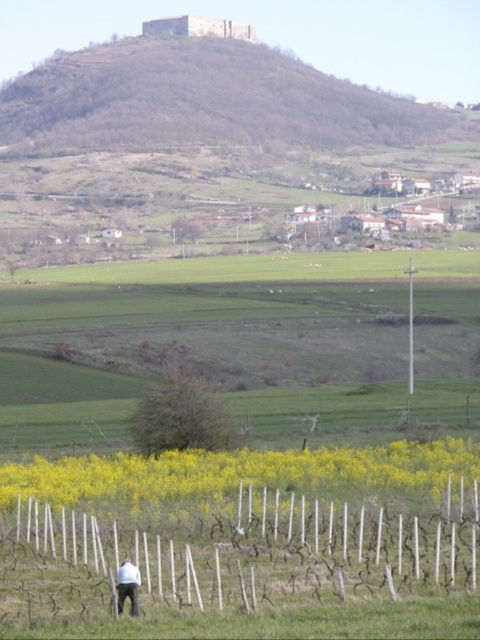
You are standing in the rural landscape and want to place a small flag at both point (466,451) and point (119,602). Which point is closer to you?

Point (119,602) is closer to you because point (466,451) is further away from the camera.

You are a landscape architect designing a new garden layout. You need to place a decorative stone path that starts from the yellow flower field in the foreground and leads towards the distant hilltop structure. According to the image, where exactly should the path end in relation to the bare earth hillside at upper center?

The path should end at the position of the bare earth hillside at upper center, which is located at coordinates point (x=204, y=100).

You are standing in the rural landscape and want to take a photo of the dark blue jeans at lower center without the bare earth hillside at upper center blocking the view. Is this possible?

The dark blue jeans at lower center is behind the bare earth hillside at upper center, so it would be blocked from view. To capture the dark blue jeans at lower center without obstruction, you would need to move to a position where the bare earth hillside at upper center is no longer between you and the dark blue jeans at lower center.